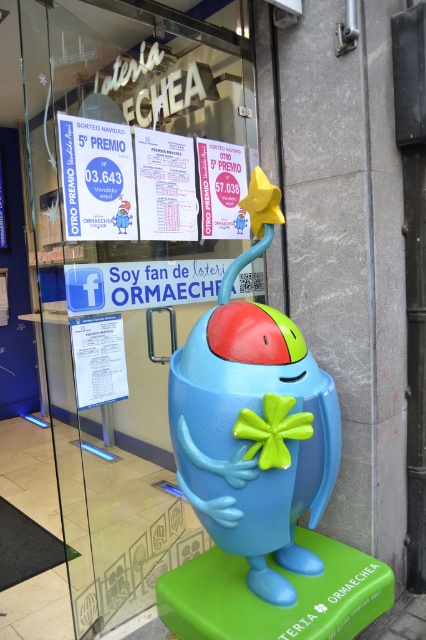
Between matte plastic toy at center and matte pink paper at upper center, which one is positioned lower?

matte plastic toy at center

Between point (301, 378) and point (241, 228), which one is positioned behind?

Point (241, 228)

Describe the element at coordinates (253, 422) in the screenshot. I see `matte plastic toy at center` at that location.

The width and height of the screenshot is (426, 640). I want to click on matte plastic toy at center, so click(253, 422).

Who is positioned more to the left, transparent glass at center or matte plastic toy at center?

Positioned to the left is transparent glass at center.

Does point (54, 202) come farther from viewer compared to point (288, 369)?

Yes.

Identify the location of transparent glass at center. The height and width of the screenshot is (640, 426). (123, 259).

You are a GUI agent. You are given a task and a screenshot of the screen. Output one action in this format:
    pyautogui.click(x=<x>, y=<y>)
    Task: Click on the transparent glass at center
    This screenshot has width=426, height=640.
    Given the screenshot: What is the action you would take?
    pyautogui.click(x=123, y=259)

Can you confirm if transparent glass at center is bigger than matte pink paper at upper center?

Yes, transparent glass at center is bigger than matte pink paper at upper center.

Is transparent glass at center thinner than matte pink paper at upper center?

Incorrect, transparent glass at center's width is not less than matte pink paper at upper center's.

Between point (89, 355) and point (198, 141), which one is positioned behind?

The point (198, 141) is behind.

You are a GUI agent. You are given a task and a screenshot of the screen. Output one action in this format:
    pyautogui.click(x=<x>, y=<y>)
    Task: Click on the transparent glass at center
    
    Given the screenshot: What is the action you would take?
    (x=123, y=259)